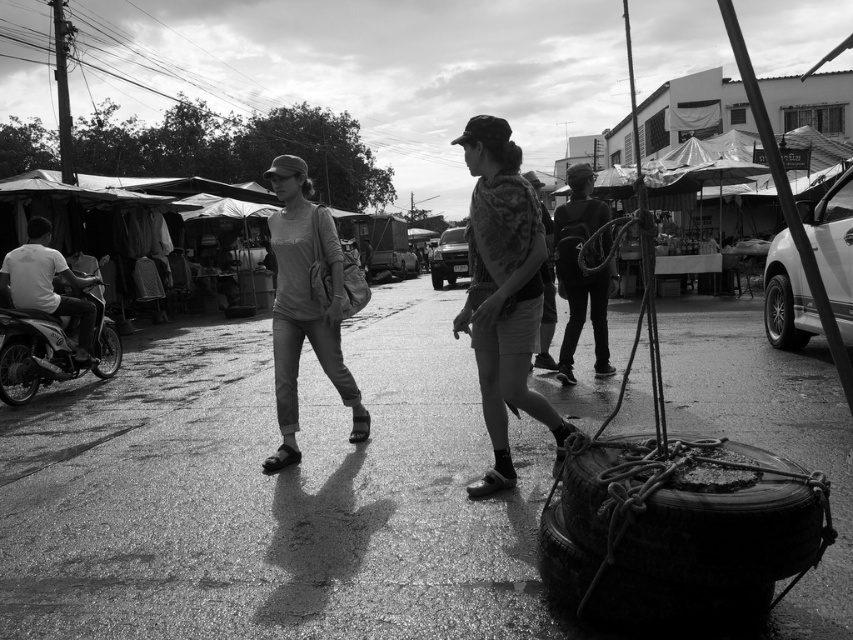
Question: Can you confirm if smooth asphalt pavement at center is wider than rough rubber tire at lower right?

Choices:
 (A) no
 (B) yes

Answer: (B)

Question: Considering the real-world distances, which object is closest to the white shirt at left?

Choices:
 (A) rubber/textured tire at right
 (B) rubber tire at left

Answer: (B)

Question: Based on their relative distances, which object is nearer to the camo fabric shirt at center?

Choices:
 (A) dark gray fabric backpack at center
 (B) white shirt at left
 (C) rubber tire at lower left

Answer: (A)

Question: Is matte gray pants at center to the right of rubber/textured tire at right from the viewer's perspective?

Choices:
 (A) no
 (B) yes

Answer: (A)

Question: Can you confirm if smooth asphalt pavement at center is smaller than smooth metallic pole at upper left?

Choices:
 (A) yes
 (B) no

Answer: (A)

Question: Which point appears closest to the camera in this image?

Choices:
 (A) (264, 616)
 (B) (3, 396)
 (C) (786, 326)
 (D) (44, 218)

Answer: (A)